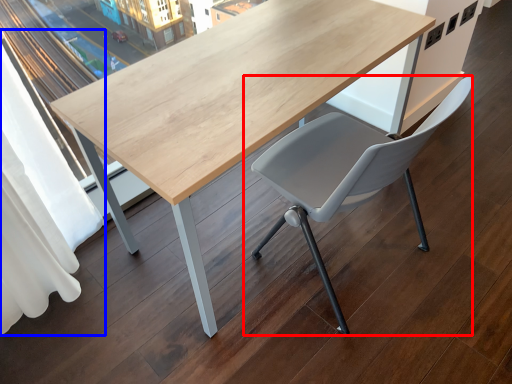
Question: Which of the following is the closest to the observer, chair (highlighted by a red box) or curtain (highlighted by a blue box)?

Choices:
 (A) chair
 (B) curtain

Answer: (B)